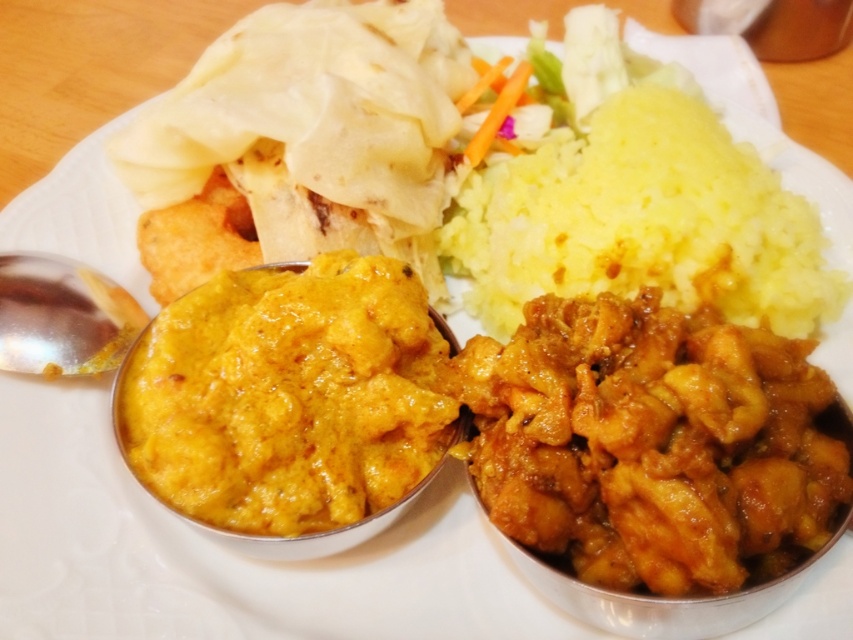
You are a food critic examining the plate and want to taste the curry closest to you. Which point should you pick, point (x=752, y=461) or point (x=65, y=259)?

Point (x=752, y=461) is closer to the viewer than point (x=65, y=259), so you should pick point (x=752, y=461) to taste the curry closest to you.